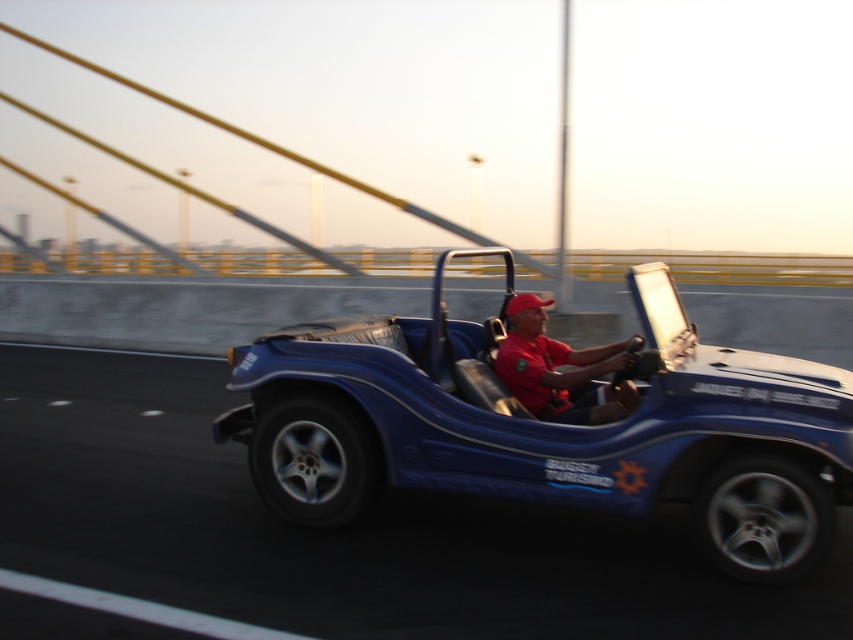
Is blue matte buggy at center to the right of red matte shirt at center from the viewer's perspective?

No, blue matte buggy at center is not to the right of red matte shirt at center.

Is the position of blue matte buggy at center less distant than that of red matte shirt at center?

Yes, blue matte buggy at center is in front of red matte shirt at center.

This screenshot has width=853, height=640. What are the coordinates of `blue matte buggy at center` in the screenshot? It's located at (550, 428).